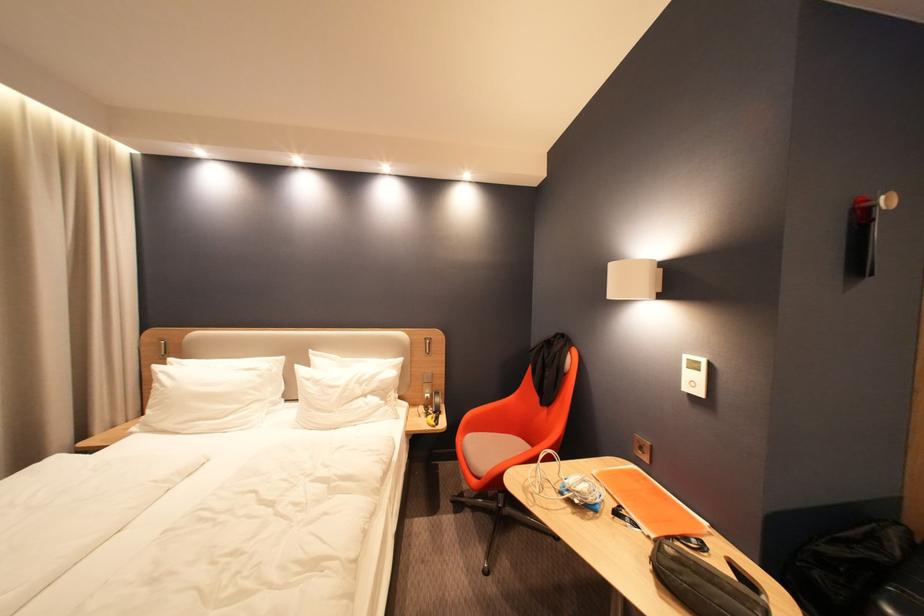
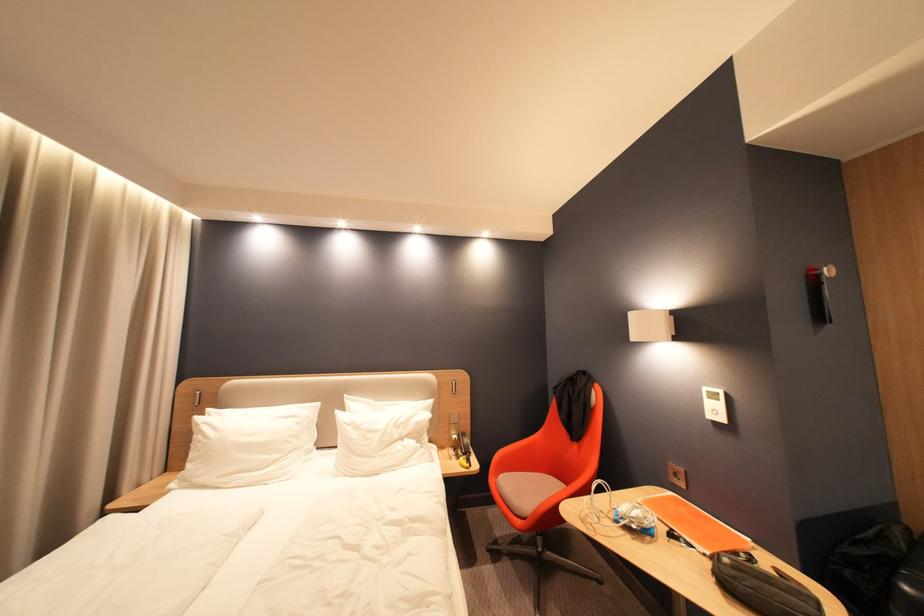
In a continuous first-person perspective shot, in which direction is the camera moving?

The cameraman moved toward left, backward.